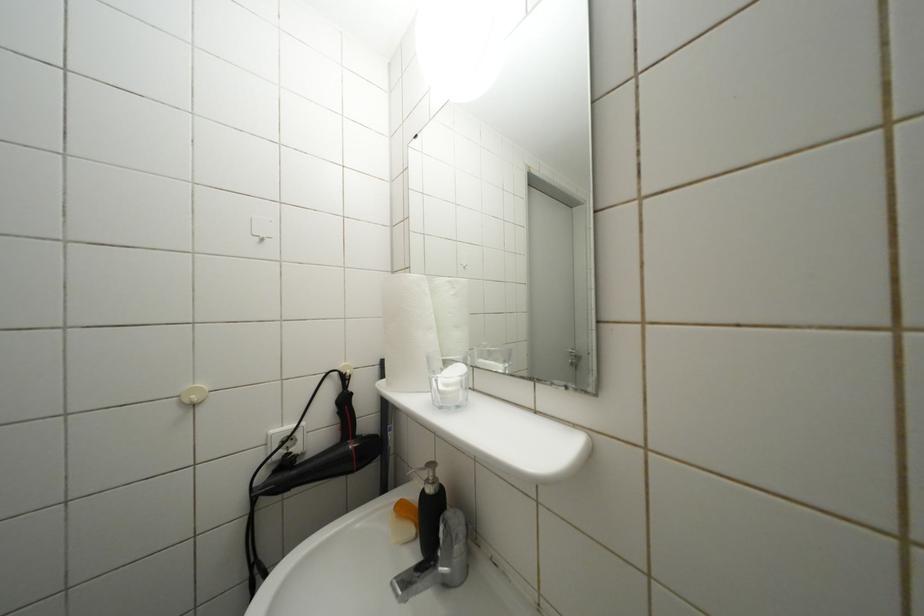
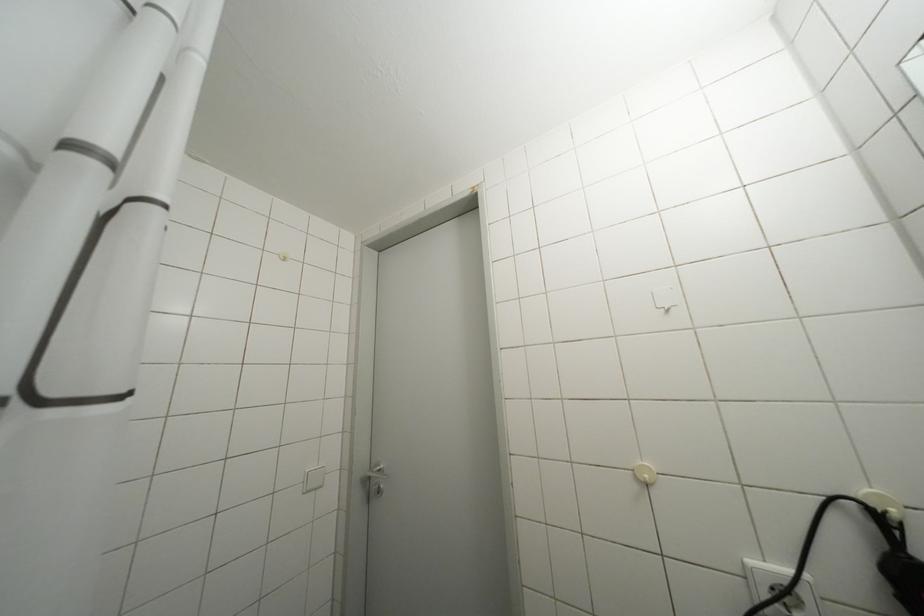
Question: The first image is from the beginning of the video and the second image is from the end. How did the camera likely rotate when shooting the video?

Choices:
 (A) Left
 (B) Right
 (C) Up
 (D) Down

Answer: (A)